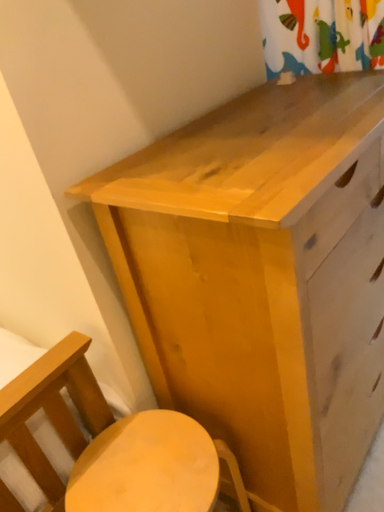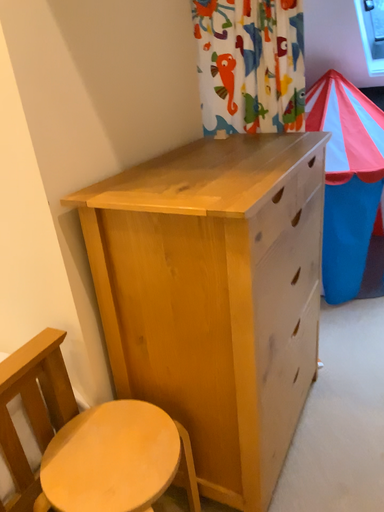
Question: How did the camera likely rotate when shooting the video?

Choices:
 (A) rotated right
 (B) rotated left

Answer: (A)